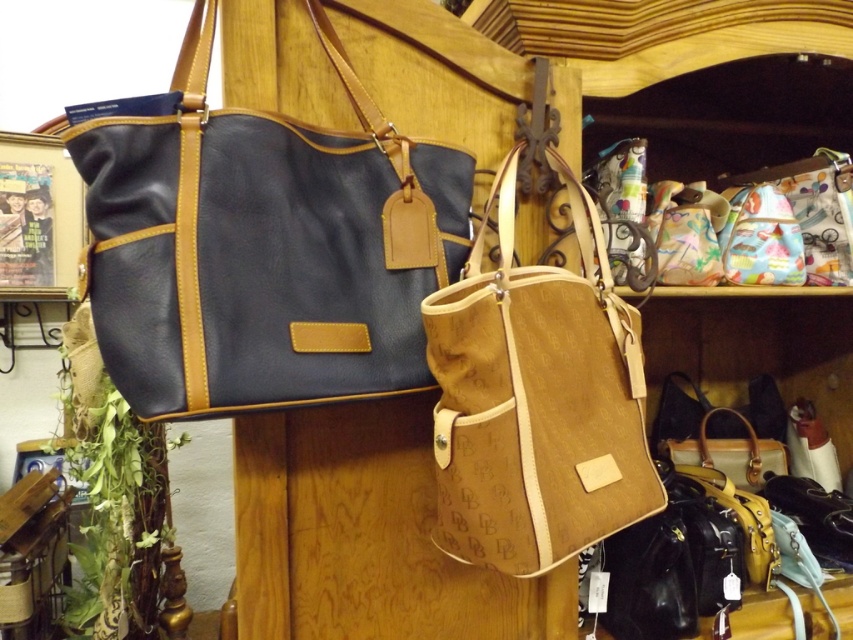
Can you confirm if matte black leather shoulder bag at left is smaller than brown canvas tote at center?

Incorrect, matte black leather shoulder bag at left is not smaller in size than brown canvas tote at center.

Find the location of a particular element. The width and height of the screenshot is (853, 640). matte black leather shoulder bag at left is located at coordinates (262, 246).

Find the location of `matte black leather shoulder bag at left`. matte black leather shoulder bag at left is located at coordinates (262, 246).